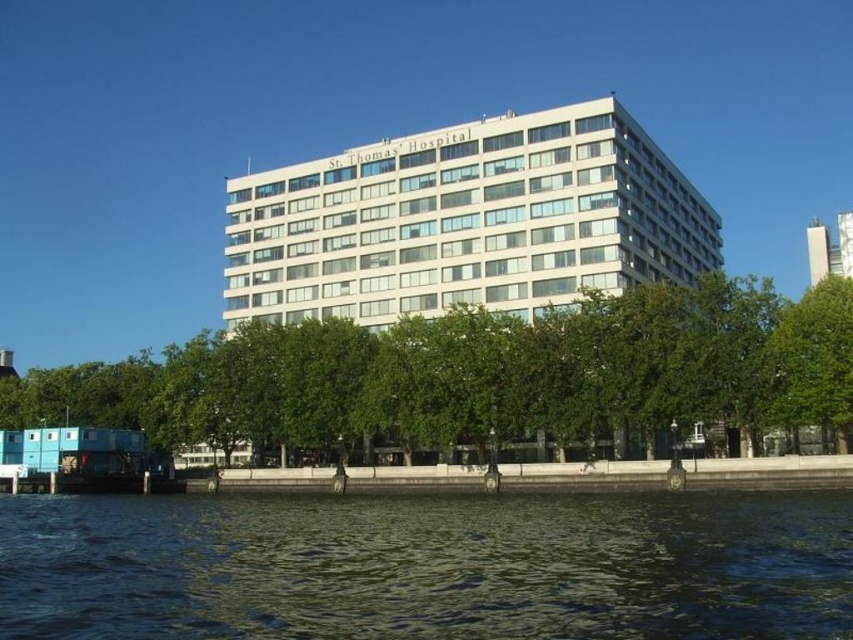
You are a visitor arriving at St. Thomas Hospital and see the dark blue water at lower center and the green leafy tree at center. Which object appears larger in the image?

The green leafy tree at center appears larger than the dark blue water at lower center.